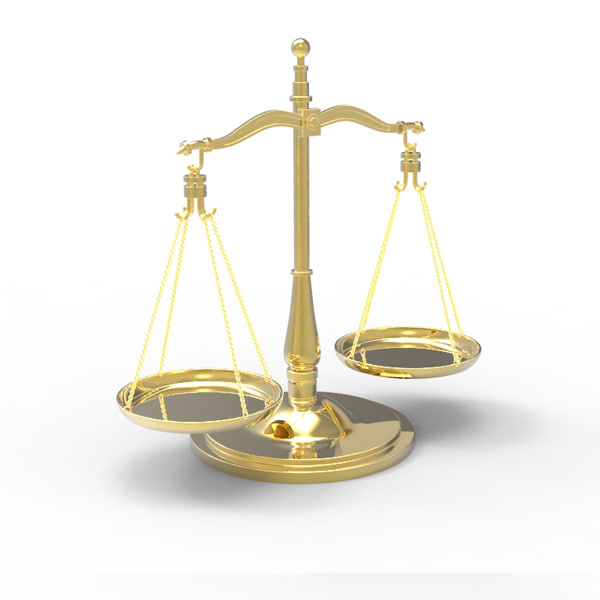
Locate an element on the screen. hook is located at coordinates (400, 187).